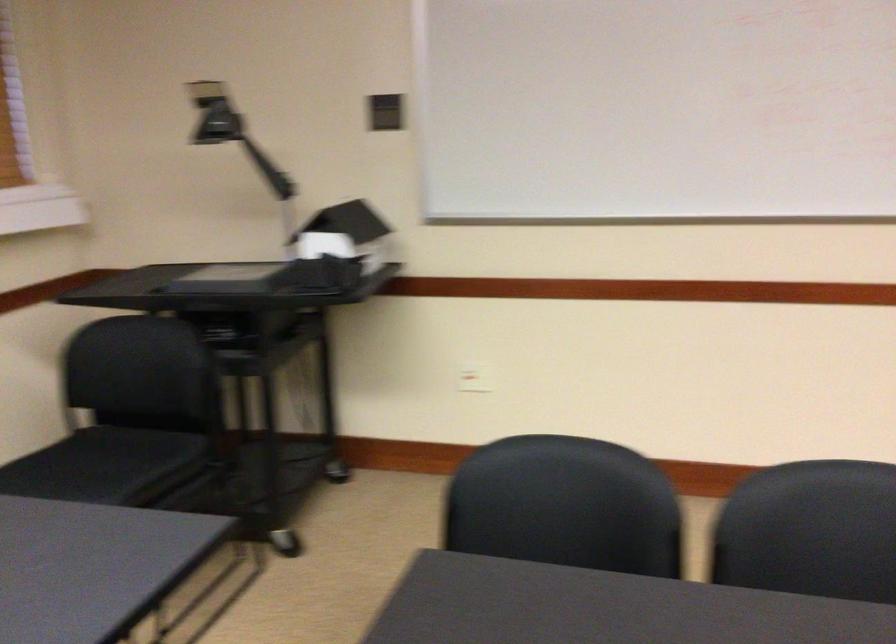
Image resolution: width=896 pixels, height=644 pixels. Describe the element at coordinates (474, 377) in the screenshot. I see `the wall power outlet` at that location.